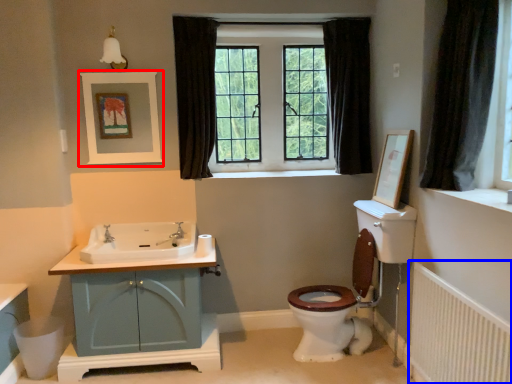
Question: Which object is further to the camera taking this photo, picture frame (highlighted by a red box) or radiator (highlighted by a blue box)?

Choices:
 (A) picture frame
 (B) radiator

Answer: (A)